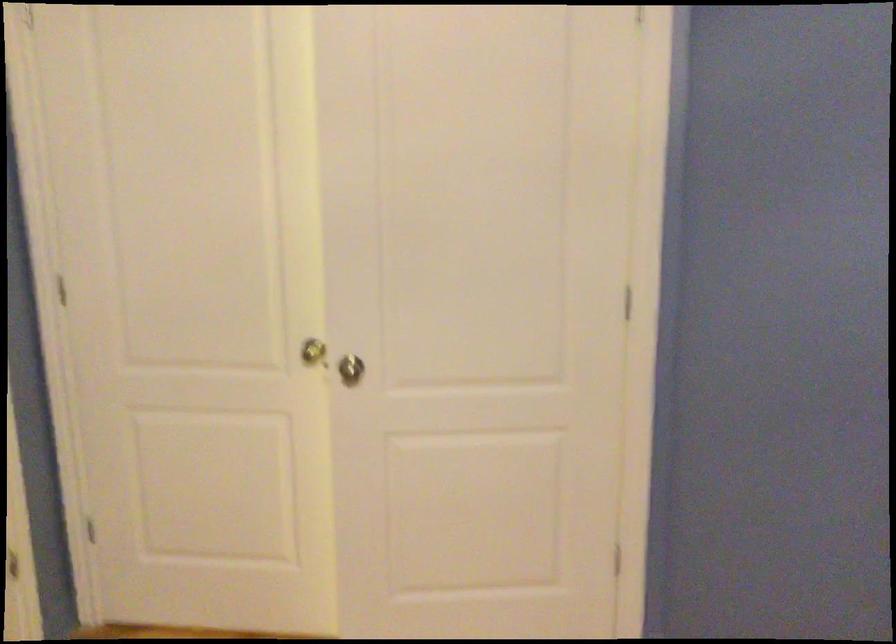
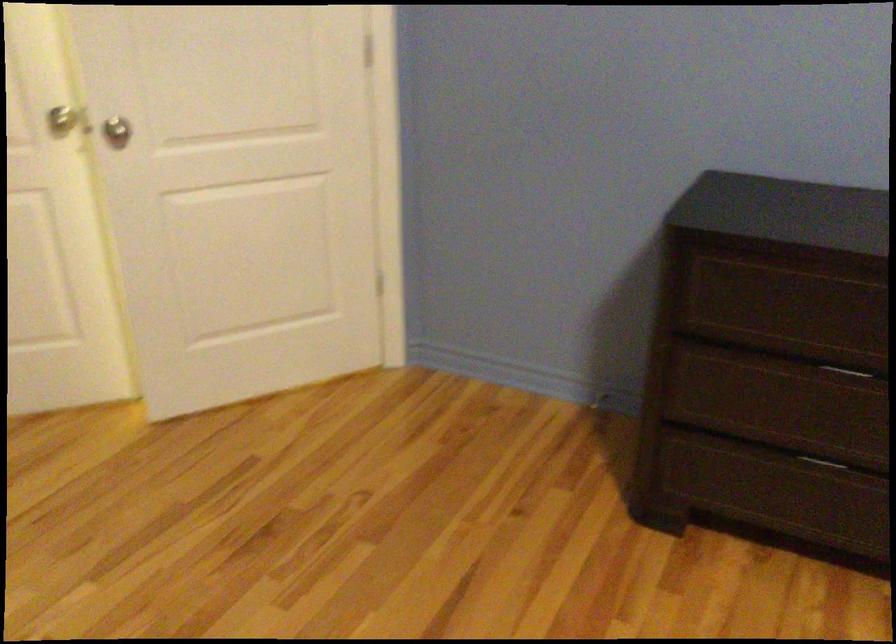
Where in the second image is the point corresponding to the point at 359,371 from the first image?

(116, 131)